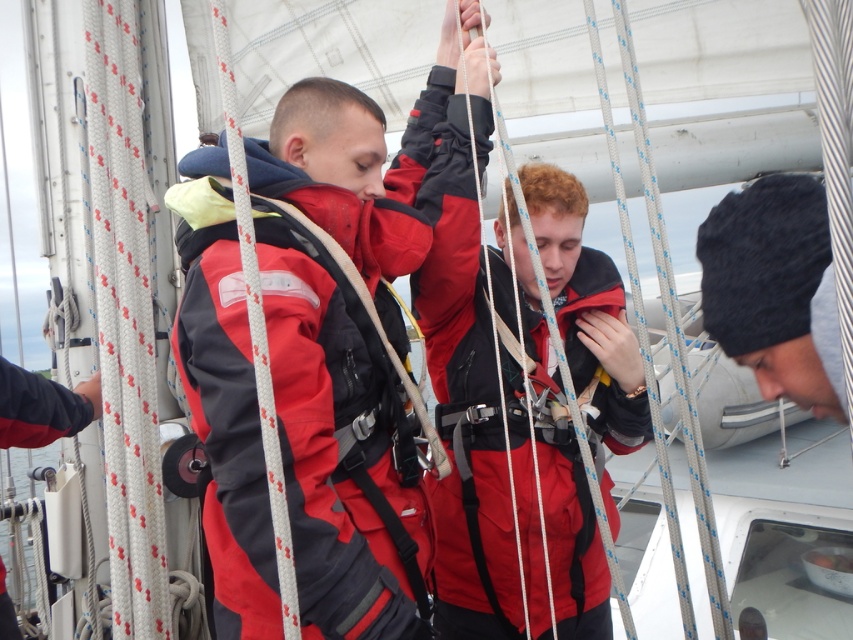
Question: Which point is closer to the camera taking this photo?

Choices:
 (A) (469, 332)
 (B) (805, 314)

Answer: (B)

Question: Which of the following is the farthest from the observer?

Choices:
 (A) black knit cap at lower right
 (B) matte black jacket at center

Answer: (B)

Question: Is red matte jacket at center wider than black knit cap at lower right?

Choices:
 (A) no
 (B) yes

Answer: (B)

Question: Estimate the real-world distances between objects in this image. Which object is closer to the matte black jacket at center?

Choices:
 (A) black knit cap at lower right
 (B) red matte jacket at center

Answer: (B)

Question: Does matte black jacket at center have a greater width compared to black knit cap at lower right?

Choices:
 (A) yes
 (B) no

Answer: (A)

Question: Does red matte jacket at center have a greater width compared to matte black jacket at center?

Choices:
 (A) yes
 (B) no

Answer: (B)